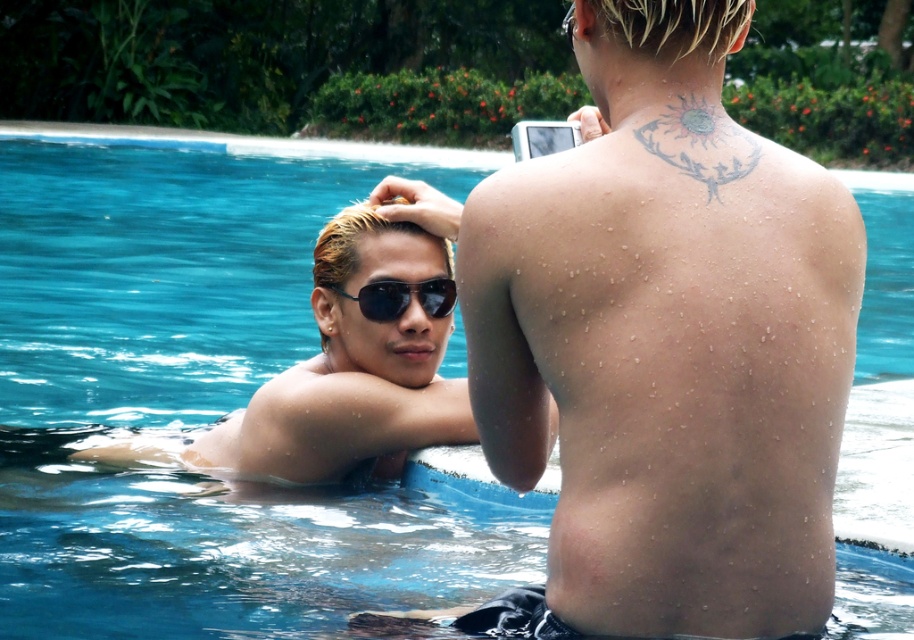
Question: Can you confirm if shiny wet skin at upper right is positioned to the right of black reflective sunglasses at upper center?

Choices:
 (A) yes
 (B) no

Answer: (A)

Question: Is shiny wet skin at upper right above sunglasses at upper center?

Choices:
 (A) no
 (B) yes

Answer: (B)

Question: Which point is closer to the camera?

Choices:
 (A) (654, 412)
 (B) (363, 424)
 (C) (737, 170)

Answer: (A)

Question: Is gray ink sun at upper back to the right of black reflective sunglasses at upper center from the viewer's perspective?

Choices:
 (A) yes
 (B) no

Answer: (A)

Question: Which of the following is the closest to the observer?

Choices:
 (A) (368, 310)
 (B) (657, 138)

Answer: (B)

Question: Which point appears closest to the camera in this image?

Choices:
 (A) (711, 44)
 (B) (360, 296)
 (C) (137, 460)

Answer: (A)